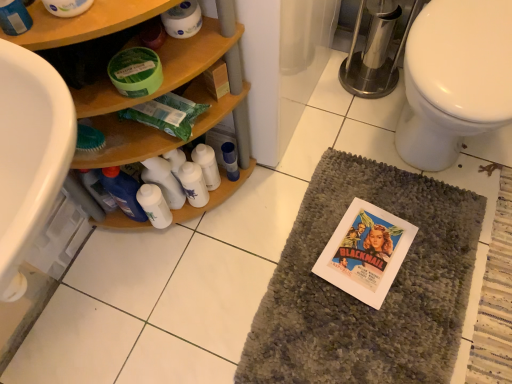
At what (x,y) coordinates should I click in order to perform the action: click on free space between blue glossy bottle at center, the first bottle positioned from the right, and gray textured bath mat at center. Please return your answer as a coordinate pair (x, y). This screenshot has height=384, width=512. Looking at the image, I should click on (262, 230).